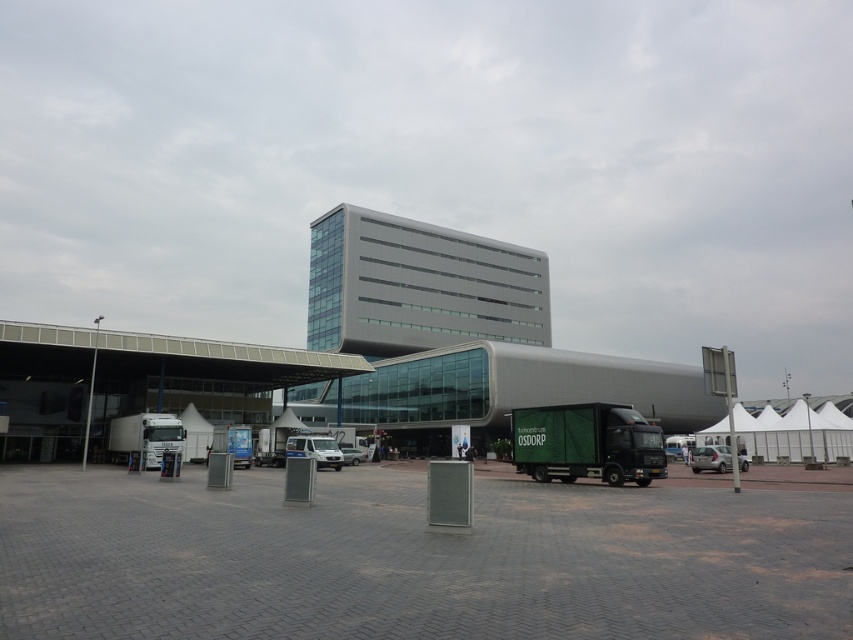
Between silver metallic sedan at lower right and silver metallic van at center, which one is positioned higher?

silver metallic sedan at lower right

I want to click on silver metallic sedan at lower right, so click(711, 458).

Based on the photo, can you confirm if white glossy truck at left is taller than silver metallic van at center?

Yes, white glossy truck at left is taller than silver metallic van at center.

Looking at this image, does white glossy truck at left have a lesser width compared to silver metallic van at center?

No.

Between point (154, 428) and point (343, 451), which one is positioned behind?

The point (343, 451) is more distant.

Locate an element on the screen. This screenshot has width=853, height=640. white glossy truck at left is located at coordinates (148, 435).

Which is below, green matte truck at lower right or silver metallic van at center?

silver metallic van at center is lower down.

From the picture: Can you confirm if green matte truck at lower right is wider than silver metallic van at center?

Correct, the width of green matte truck at lower right exceeds that of silver metallic van at center.

What do you see at coordinates (585, 444) in the screenshot? I see `green matte truck at lower right` at bounding box center [585, 444].

The height and width of the screenshot is (640, 853). Find the location of `green matte truck at lower right`. green matte truck at lower right is located at coordinates (585, 444).